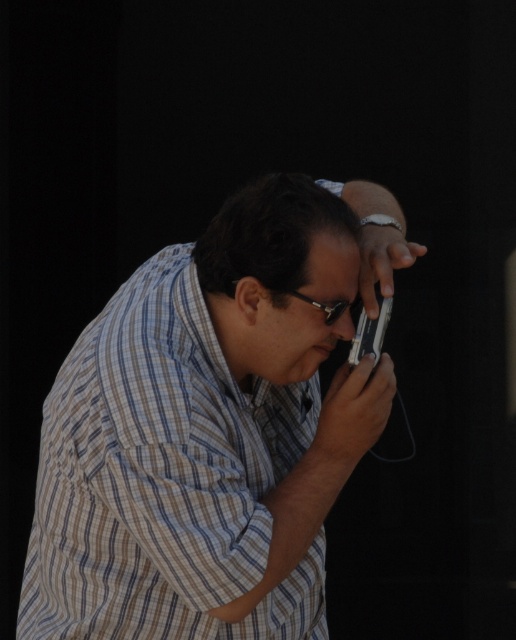
Which is more to the right, striped cotton shirt at center or sleek silver phone at center?

From the viewer's perspective, sleek silver phone at center appears more on the right side.

Which is behind, point (138, 378) or point (378, 337)?

Point (378, 337)

Identify the location of striped cotton shirt at center. (214, 426).